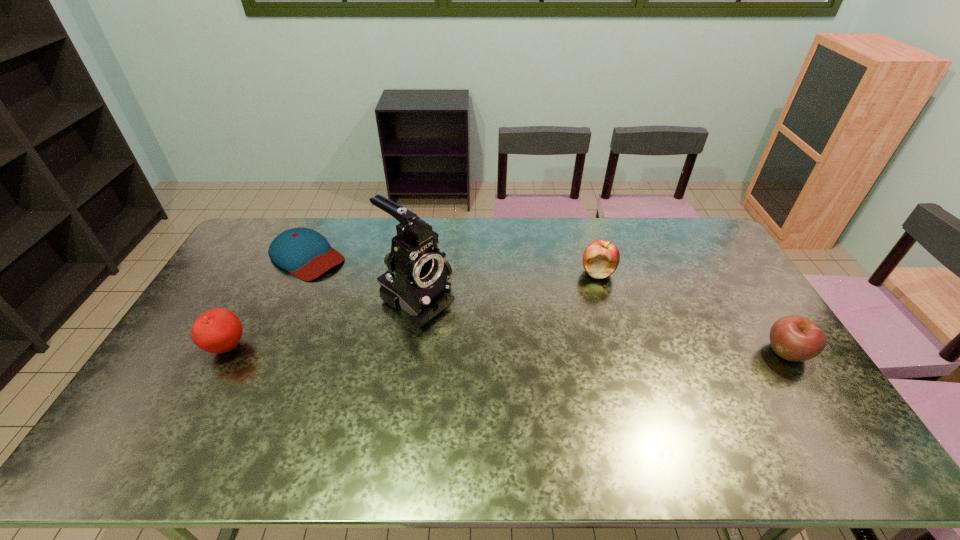
I want to click on the leftmost apple, so click(x=218, y=330).

Where is `the rightmost object`? the rightmost object is located at coordinates (795, 338).

The width and height of the screenshot is (960, 540). I want to click on the fourth tallest object, so click(795, 338).

Locate an element on the screen. This screenshot has width=960, height=540. the farthest apple is located at coordinates (601, 258).

Identify the location of the second object from right to left. (601, 258).

Image resolution: width=960 pixels, height=540 pixels. Find the location of `the tallest object`. the tallest object is located at coordinates (416, 281).

This screenshot has height=540, width=960. I want to click on camcorder, so click(x=416, y=281).

The height and width of the screenshot is (540, 960). I want to click on the shortest object, so click(305, 253).

Find the location of `vacant region located on the right of the leftmost apple`. vacant region located on the right of the leftmost apple is located at coordinates (337, 347).

This screenshot has height=540, width=960. I want to click on vacant space positioned 0.080m on the side of the rightmost object with the unique marking, so click(x=815, y=395).